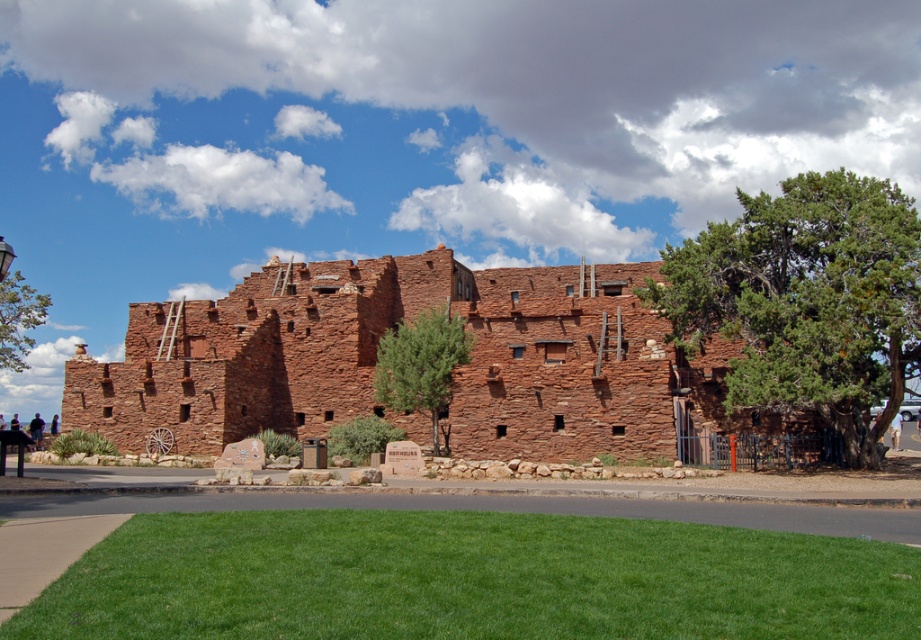
You are a visitor standing at the entrance of the adobe building and want to find the restroom. You see the light brown shorts at lower right and the light brown wooden sign at center. Which object is closer to the ground?

The light brown shorts at lower right is shorter than the light brown wooden sign at center, so it is closer to the ground.

You are standing at the entrance of the adobe building and want to walk to the green asphalt at lower center. According to the coordinates provided, where exactly should you head?

The green asphalt at lower center is located at point (499,508), so you should head towards that coordinate to reach it.